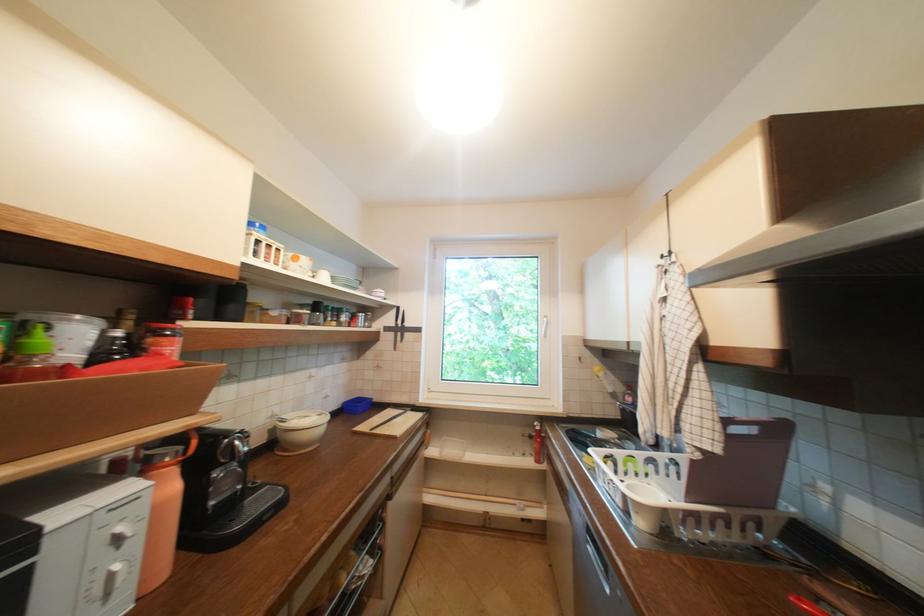
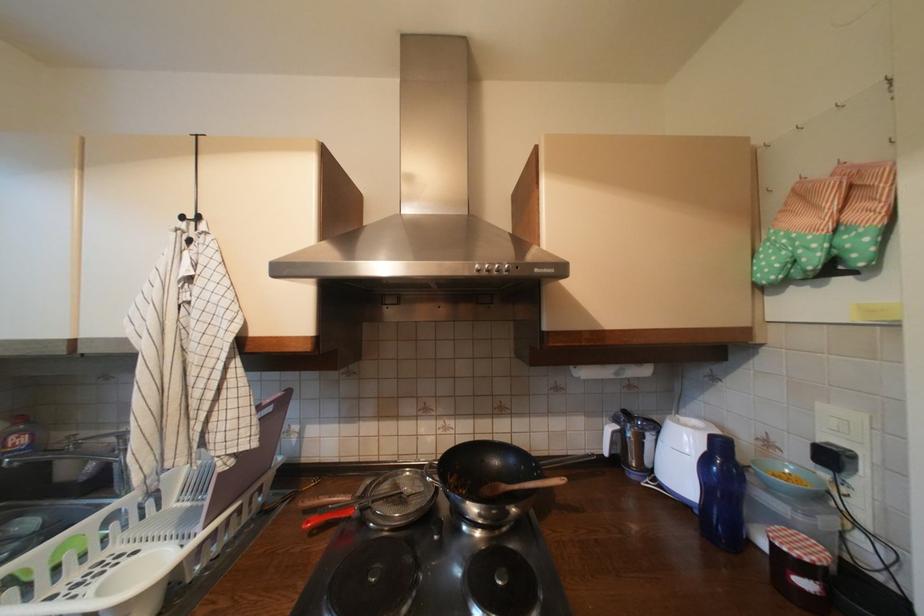
Find the pixel in the second image that matches [666,267] in the first image.

(187, 230)